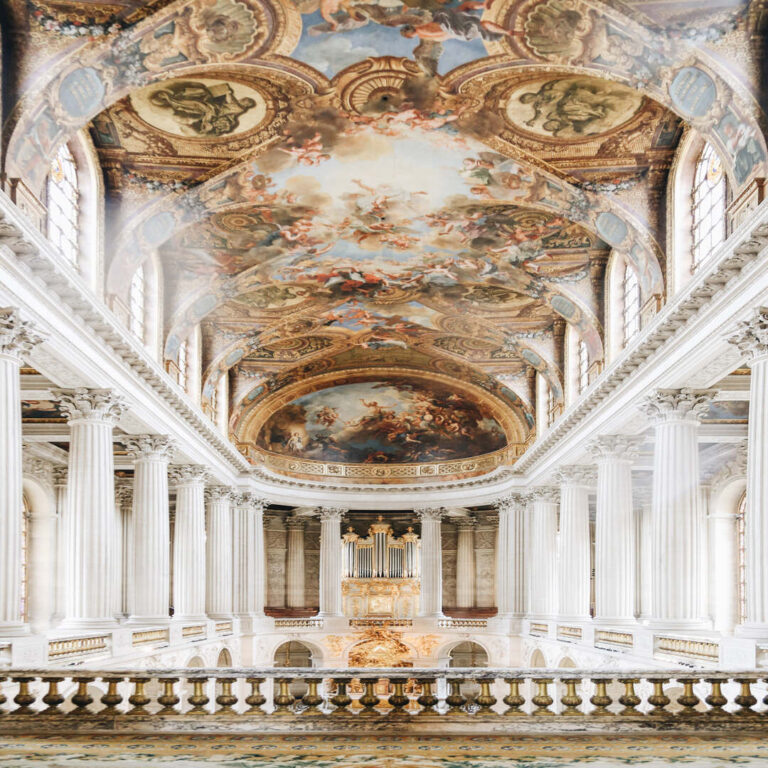
I want to click on small domes on ceiling, so coord(276,96), coord(480,108), coord(286,306), coord(482,299), coord(316,346), coord(455,351).